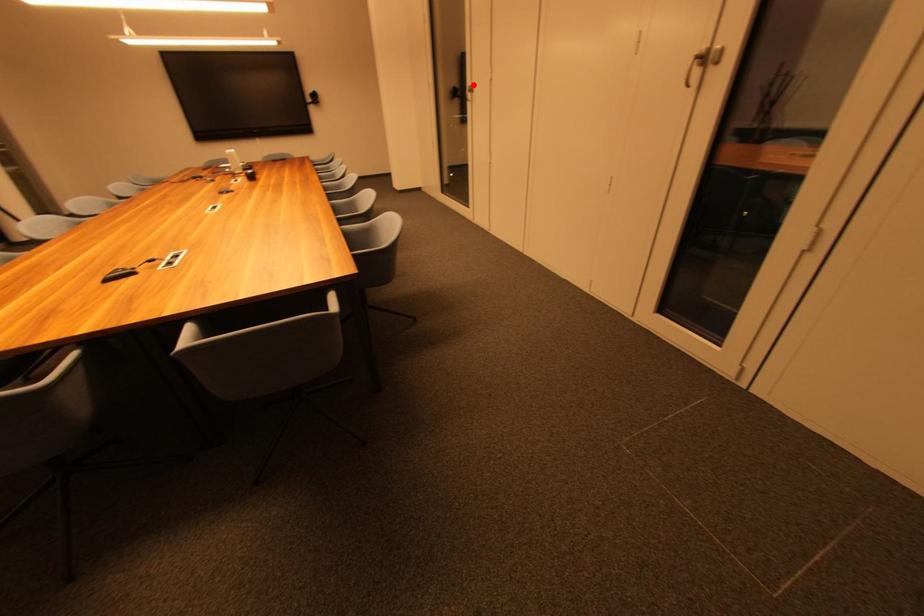
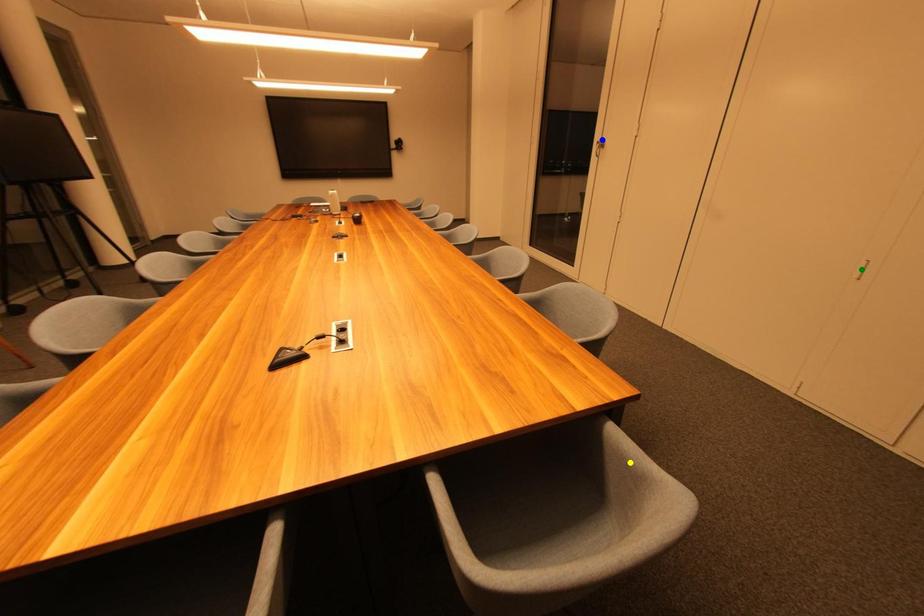
Question: I am providing you with two images of the same scene from different viewpoints. A red point is marked on the first image. You are given multiple points on the second image. Which spot in image 2 lines up with the point in image 1?

Choices:
 (A) yellow point
 (B) green point
 (C) blue point

Answer: (C)